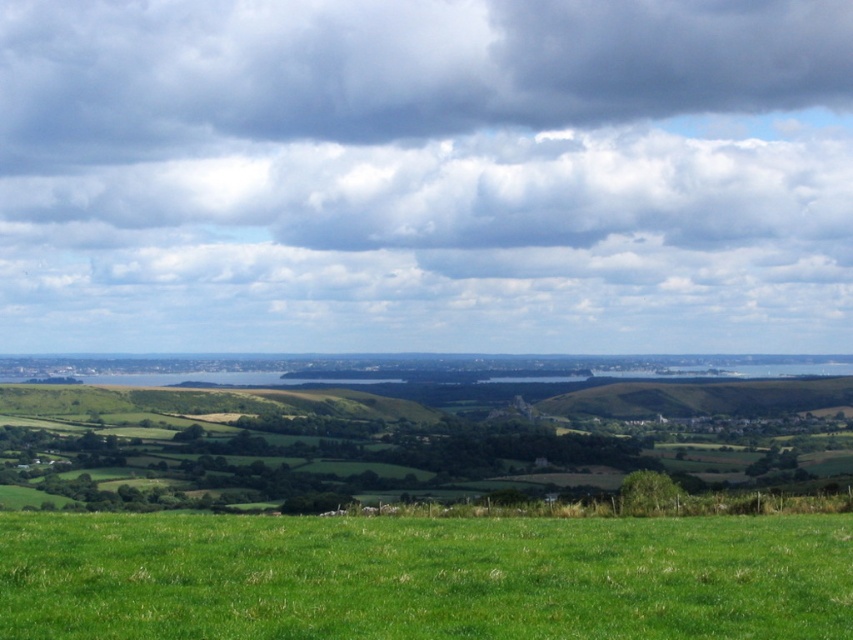
Question: Is dark gray cloud at upper center below green grassy field at lower center?

Choices:
 (A) no
 (B) yes

Answer: (A)

Question: Does cloudy sky at upper center have a lesser width compared to dark gray cloud at upper center?

Choices:
 (A) yes
 (B) no

Answer: (B)

Question: Which object appears closest to the camera in this image?

Choices:
 (A) dark gray cloud at upper center
 (B) cloudy sky at upper center
 (C) green grassy hillside at center

Answer: (C)

Question: Which of these objects is positioned closest to the green grassy field at lower center?

Choices:
 (A) green grassy hillside at center
 (B) dark gray cloud at upper center
 (C) cloudy sky at upper center

Answer: (A)

Question: Can you confirm if green grassy field at lower center is smaller than green grassy hillside at center?

Choices:
 (A) no
 (B) yes

Answer: (B)

Question: Which object appears closest to the camera in this image?

Choices:
 (A) green grassy field at lower center
 (B) green grassy hillside at center
 (C) cloudy sky at upper center

Answer: (A)